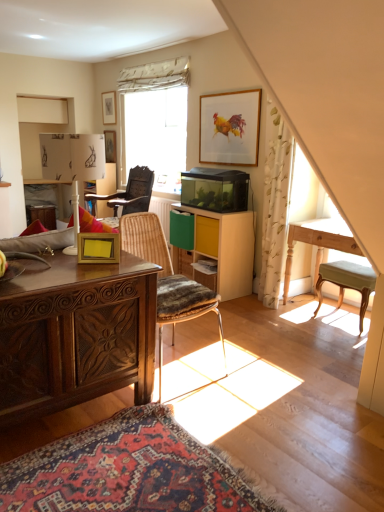
Question: Is polished wood desk at left wider than rustic wood chair at center, the 2th chair viewed from the left?

Choices:
 (A) yes
 (B) no

Answer: (A)

Question: Does polished wood desk at left have a greater height compared to rustic wood chair at center, arranged as the 3th chair when viewed from the back?

Choices:
 (A) no
 (B) yes

Answer: (A)

Question: Is polished wood desk at left not near rustic wood chair at center, arranged as the 3th chair when viewed from the back?

Choices:
 (A) yes
 (B) no

Answer: (B)

Question: Could you tell me if polished wood desk at left is facing rustic wood chair at center, the second chair positioned from the right?

Choices:
 (A) no
 (B) yes

Answer: (A)

Question: Does polished wood desk at left appear on the left side of rustic wood chair at center, the second chair positioned from the right?

Choices:
 (A) no
 (B) yes

Answer: (B)

Question: Do you think wooden picture frame at upper center, which appears as the 3th picture frame when viewed from the back, is within green fabric stool at right, the 2th chair when ordered from front to back, or outside of it?

Choices:
 (A) outside
 (B) inside

Answer: (A)

Question: Considering the positions of wooden picture frame at upper center, which is the second picture frame from front to back, and green fabric stool at right, the 2th chair when ordered from front to back, in the image, is wooden picture frame at upper center, which is the second picture frame from front to back, bigger or smaller than green fabric stool at right, the 2th chair when ordered from front to back,?

Choices:
 (A) small
 (B) big

Answer: (A)

Question: Is point (251, 148) closer or farther from the camera than point (362, 317)?

Choices:
 (A) closer
 (B) farther

Answer: (B)

Question: In terms of width, does wooden picture frame at upper center, which is the 3th picture frame from top to bottom, look wider or thinner when compared to green fabric stool at right, the 1th chair when ordered from right to left?

Choices:
 (A) wide
 (B) thin

Answer: (B)

Question: From a real-world perspective, is rustic wood chair at center, arranged as the 3th chair when viewed from the back, positioned above or below wooden armchair at center, the first chair from the back?

Choices:
 (A) above
 (B) below

Answer: (B)

Question: From the image's perspective, is rustic wood chair at center, the 2th chair viewed from the left, located above or below wooden armchair at center, the first chair from the back?

Choices:
 (A) above
 (B) below

Answer: (B)

Question: In the image, is rustic wood chair at center, the second chair positioned from the right, positioned in front of or behind wooden armchair at center, the first chair from the back?

Choices:
 (A) behind
 (B) front

Answer: (B)

Question: Is rustic wood chair at center, marked as the 1th chair in a front-to-back arrangement, wider or thinner than wooden armchair at center, the first chair viewed from the left?

Choices:
 (A) wide
 (B) thin

Answer: (B)

Question: From the image's perspective, relative to rustic wood chair at center, the 2th chair viewed from the left, is light wood table at right above or below?

Choices:
 (A) above
 (B) below

Answer: (A)

Question: Is light wood table at right situated inside rustic wood chair at center, arranged as the 3th chair when viewed from the back, or outside?

Choices:
 (A) outside
 (B) inside

Answer: (A)